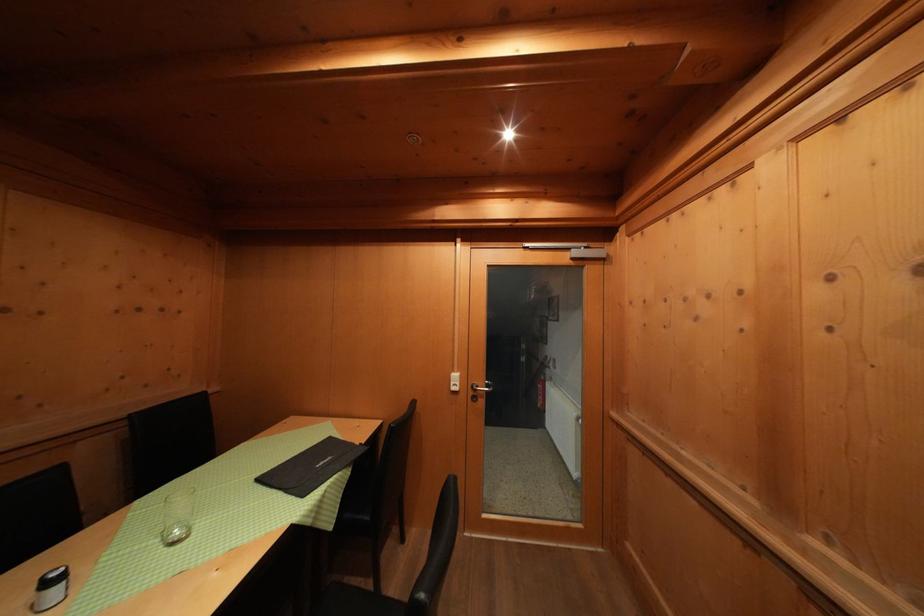
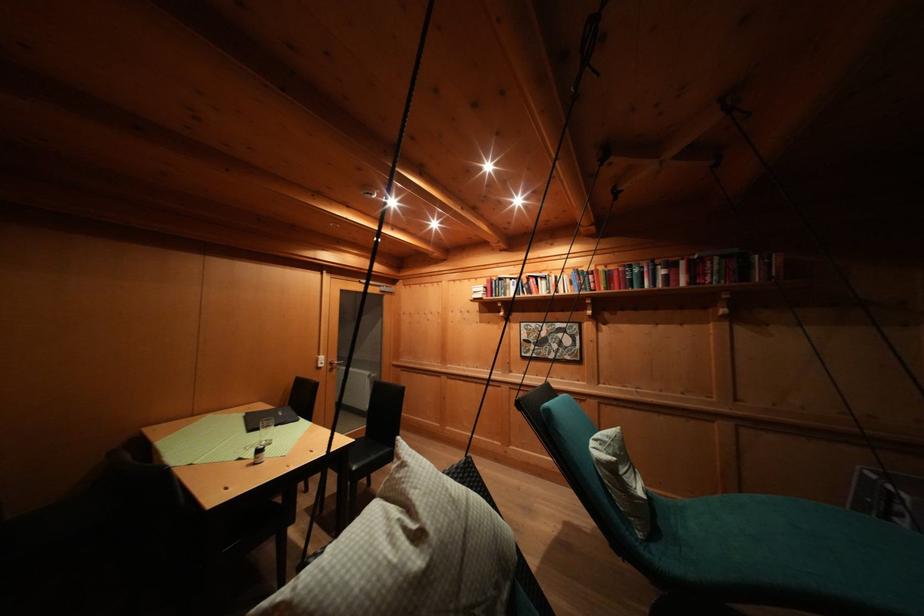
In the second image, find the point that corresponds to point 462,381 in the first image.

(327, 362)